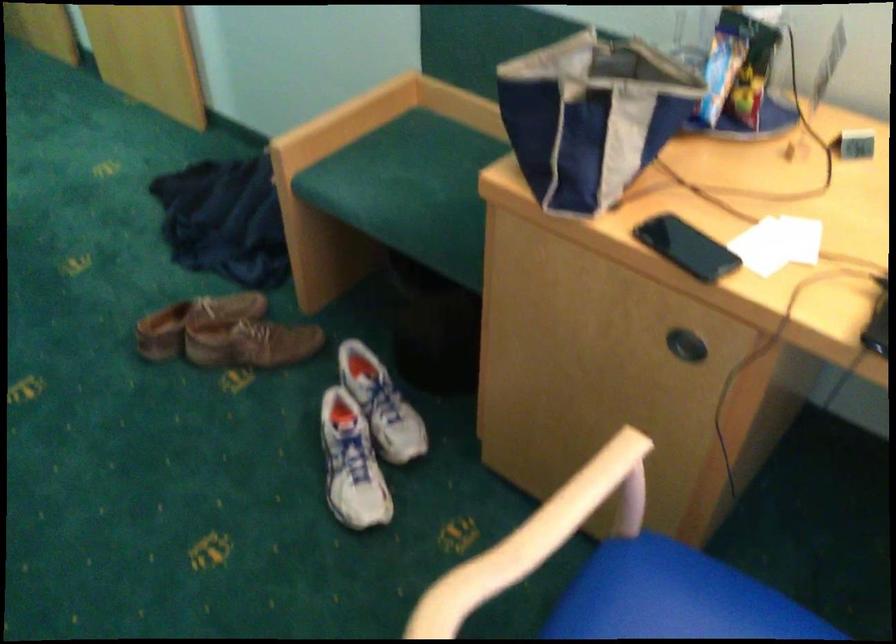
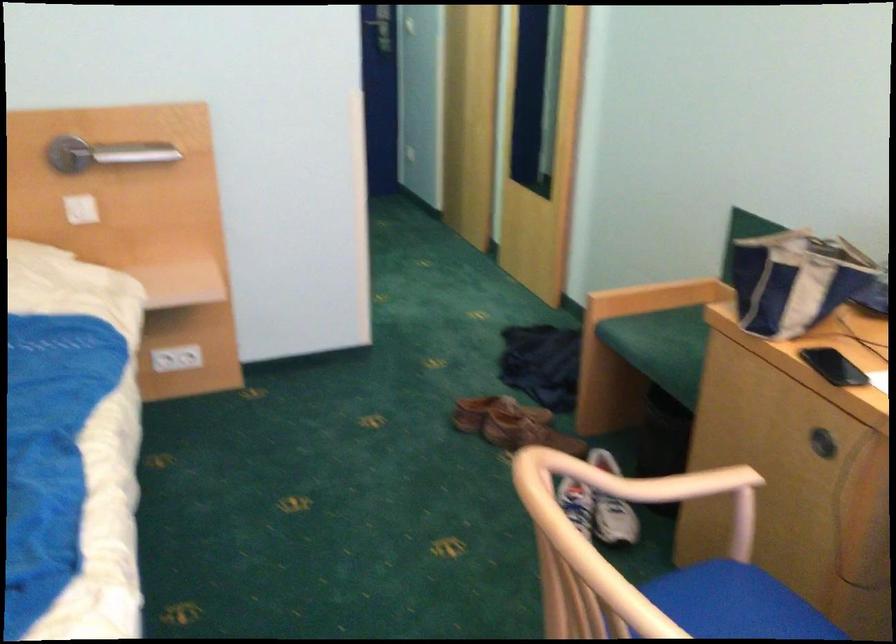
The point at (574, 127) is marked in the first image. Where is the corresponding point in the second image?

(794, 279)